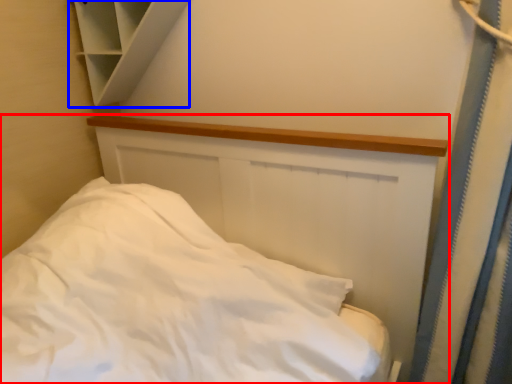
Question: Which object is closer to the camera taking this photo, bed (highlighted by a red box) or cabinet (highlighted by a blue box)?

Choices:
 (A) bed
 (B) cabinet

Answer: (A)